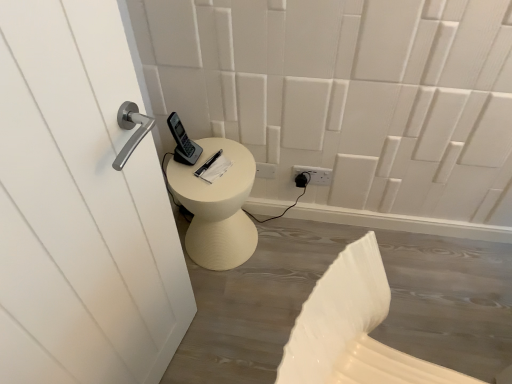
The width and height of the screenshot is (512, 384). Describe the element at coordinates (353, 329) in the screenshot. I see `white plastic swivel chair at lower right` at that location.

Locate an element on the screen. white plastic swivel chair at lower right is located at coordinates (353, 329).

The width and height of the screenshot is (512, 384). Describe the element at coordinates (315, 174) in the screenshot. I see `white plastic electric outlet at lower center` at that location.

Where is `white plastic electric outlet at lower center`? This screenshot has width=512, height=384. white plastic electric outlet at lower center is located at coordinates (315, 174).

This screenshot has width=512, height=384. I want to click on white plastic swivel chair at lower right, so click(x=353, y=329).

Which is more to the right, white plastic electric outlet at lower center or white plastic swivel chair at lower right?

From the viewer's perspective, white plastic swivel chair at lower right appears more on the right side.

Which object is further away from the camera, white plastic electric outlet at lower center or white plastic swivel chair at lower right?

white plastic electric outlet at lower center is further away from the camera.

Is point (296, 171) positioned after point (288, 357)?

Yes, point (296, 171) is behind point (288, 357).

From the image's perspective, is white plastic electric outlet at lower center positioned above or below white plastic swivel chair at lower right?

white plastic electric outlet at lower center is situated higher than white plastic swivel chair at lower right in the image.

From a real-world perspective, which is physically below, white plastic electric outlet at lower center or white plastic swivel chair at lower right?

In real-world perspective, white plastic electric outlet at lower center is lower.

Which of these two, white plastic electric outlet at lower center or white plastic swivel chair at lower right, is thinner?

With smaller width is white plastic electric outlet at lower center.

Is white plastic electric outlet at lower center taller or shorter than white plastic swivel chair at lower right?

white plastic electric outlet at lower center is shorter than white plastic swivel chair at lower right.

Considering the sizes of objects white plastic electric outlet at lower center and white plastic swivel chair at lower right in the image provided, who is smaller, white plastic electric outlet at lower center or white plastic swivel chair at lower right?

With smaller size is white plastic electric outlet at lower center.

Would you say white plastic electric outlet at lower center is inside or outside white plastic swivel chair at lower right?

white plastic electric outlet at lower center cannot be found inside white plastic swivel chair at lower right.

Is white plastic electric outlet at lower center touching white plastic swivel chair at lower right?

white plastic electric outlet at lower center is not next to white plastic swivel chair at lower right, and they're not touching.

From the picture: Is white plastic electric outlet at lower center positioned with its back to white plastic swivel chair at lower right?

That's not correct — white plastic electric outlet at lower center is not looking away from white plastic swivel chair at lower right.

What are the coordinates of `swivel chair below the white plastic electric outlet at lower center (from the image's perspective)` in the screenshot? It's located at (353, 329).

Which is more to the right, white plastic swivel chair at lower right or white plastic electric outlet at lower center?

white plastic swivel chair at lower right is more to the right.

Is the position of white plastic swivel chair at lower right less distant than that of white plastic electric outlet at lower center?

That is True.

Is point (285, 351) behind point (315, 181)?

No, it is not.

In the scene shown: From the image's perspective, is white plastic swivel chair at lower right above or below white plastic electric outlet at lower center?

From the image's perspective, white plastic swivel chair at lower right appears below white plastic electric outlet at lower center.

Looking at this image, from a real-world perspective, is white plastic swivel chair at lower right positioned over white plastic electric outlet at lower center based on gravity?

Indeed, from a real-world perspective, white plastic swivel chair at lower right stands above white plastic electric outlet at lower center.

Can you confirm if white plastic swivel chair at lower right is wider than white plastic electric outlet at lower center?

Yes.

In terms of height, does white plastic swivel chair at lower right look taller or shorter compared to white plastic electric outlet at lower center?

Clearly, white plastic swivel chair at lower right is taller compared to white plastic electric outlet at lower center.

In terms of size, does white plastic swivel chair at lower right appear bigger or smaller than white plastic electric outlet at lower center?

Considering their sizes, white plastic swivel chair at lower right takes up more space than white plastic electric outlet at lower center.

Is white plastic swivel chair at lower right located outside white plastic electric outlet at lower center?

white plastic swivel chair at lower right is positioned outside white plastic electric outlet at lower center.

Can you see white plastic swivel chair at lower right touching white plastic electric outlet at lower center?

white plastic swivel chair at lower right is not next to white plastic electric outlet at lower center, and they're not touching.

Could you tell me if white plastic swivel chair at lower right is facing white plastic electric outlet at lower center?

No, white plastic swivel chair at lower right is not facing towards white plastic electric outlet at lower center.

Can you tell me how much white plastic swivel chair at lower right and white plastic electric outlet at lower center differ in facing direction?

There is a 67.1-degree angle between the facing directions of white plastic swivel chair at lower right and white plastic electric outlet at lower center.

The height and width of the screenshot is (384, 512). I want to click on electric outlet located on the left of white plastic swivel chair at lower right, so click(x=315, y=174).

This screenshot has width=512, height=384. What are the coordinates of `electric outlet on the left side of white plastic swivel chair at lower right` in the screenshot? It's located at (315, 174).

Locate an element on the screen. The height and width of the screenshot is (384, 512). swivel chair located below the white plastic electric outlet at lower center (from the image's perspective) is located at coordinates (353, 329).